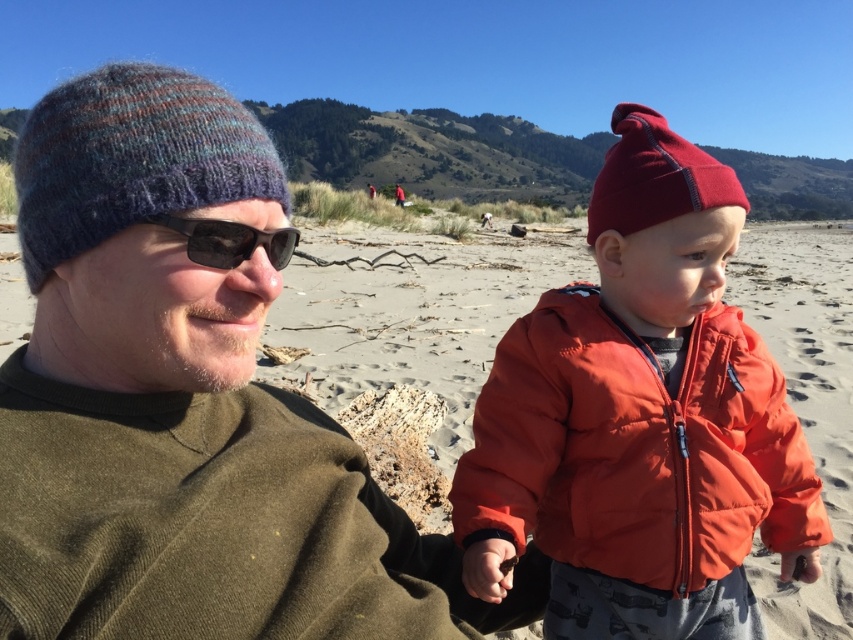
Question: Where is knitted woolen beanie at left located in relation to sunglasses at left in the image?

Choices:
 (A) above
 (B) below

Answer: (A)

Question: Which object is the closest to the knitted wool hat at left?

Choices:
 (A) sunglasses at left
 (B) matte red beanie at center
 (C) knitted woolen beanie at left
 (D) matte red beanie at right

Answer: (A)

Question: Which point is farther to the camera?

Choices:
 (A) (181, 196)
 (B) (257, 232)
 (C) (94, 193)

Answer: (B)

Question: Which object is positioned farthest from the matte red beanie at right?

Choices:
 (A) sunglasses at left
 (B) matte red beanie at center
 (C) knitted woolen beanie at left

Answer: (A)

Question: Is knitted wool hat at left in front of matte red beanie at right?

Choices:
 (A) no
 (B) yes

Answer: (B)

Question: Where is matte red beanie at center located in relation to sunglasses at left in the image?

Choices:
 (A) above
 (B) below

Answer: (A)